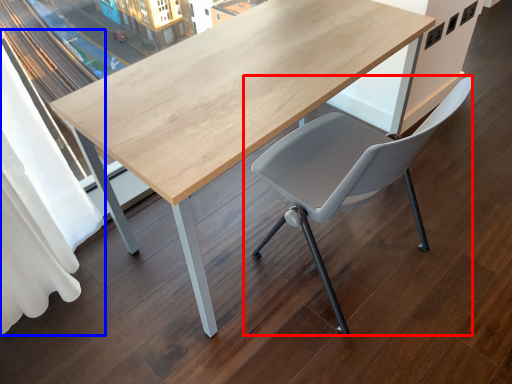
Question: Which object is further to the camera taking this photo, chair (highlighted by a red box) or curtain (highlighted by a blue box)?

Choices:
 (A) chair
 (B) curtain

Answer: (A)